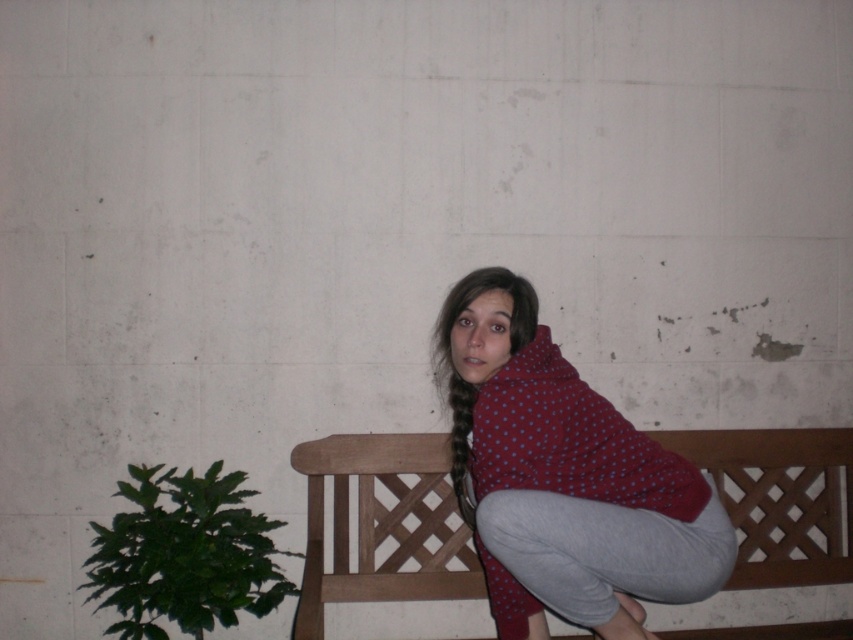
Can you confirm if polka dot fleece at center is shorter than wooden at center?

Incorrect, polka dot fleece at center's height does not fall short of wooden at center's.

Which is below, polka dot fleece at center or wooden at center?

wooden at center

Does point (660, 451) come closer to viewer compared to point (788, 634)?

Yes, it is in front of point (788, 634).

The height and width of the screenshot is (640, 853). Find the location of `polka dot fleece at center`. polka dot fleece at center is located at coordinates (564, 477).